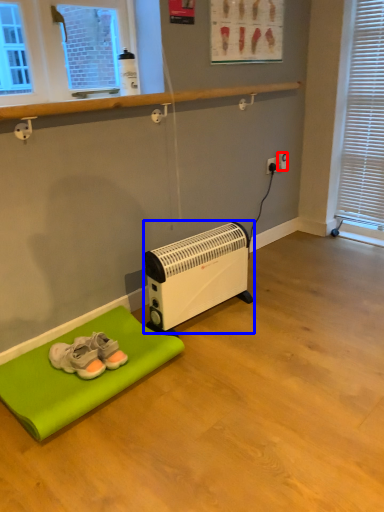
Question: Which of the following is the closest to the observer, electric outlet (highlighted by a red box) or heater (highlighted by a blue box)?

Choices:
 (A) electric outlet
 (B) heater

Answer: (B)